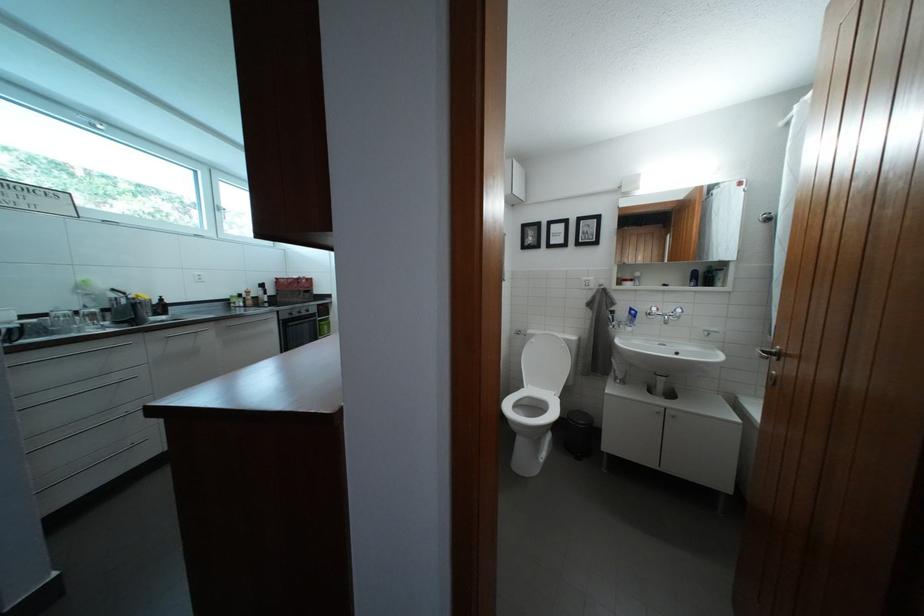
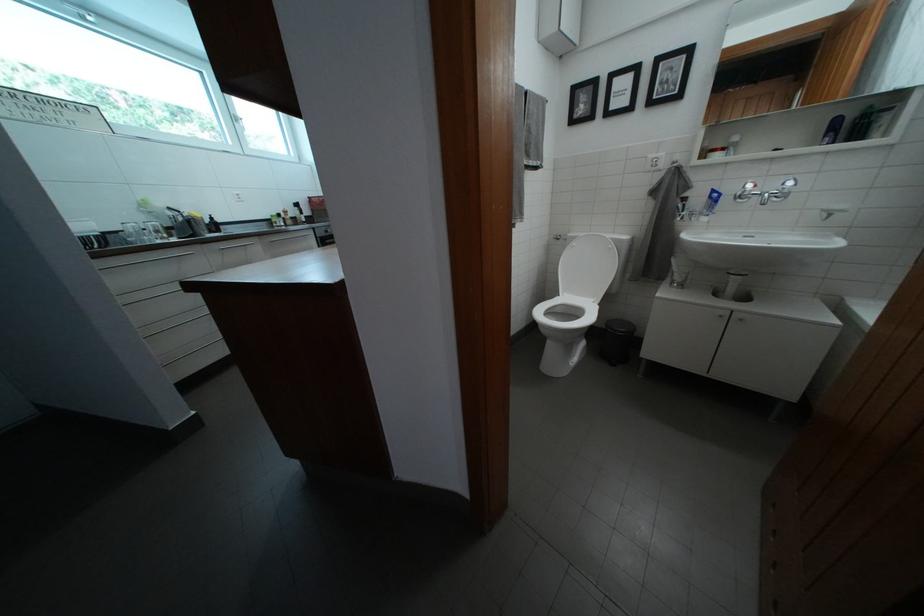
The images are taken continuously from a first-person perspective. In which direction are you moving?

The movement direction of the cameraman is right, forward.